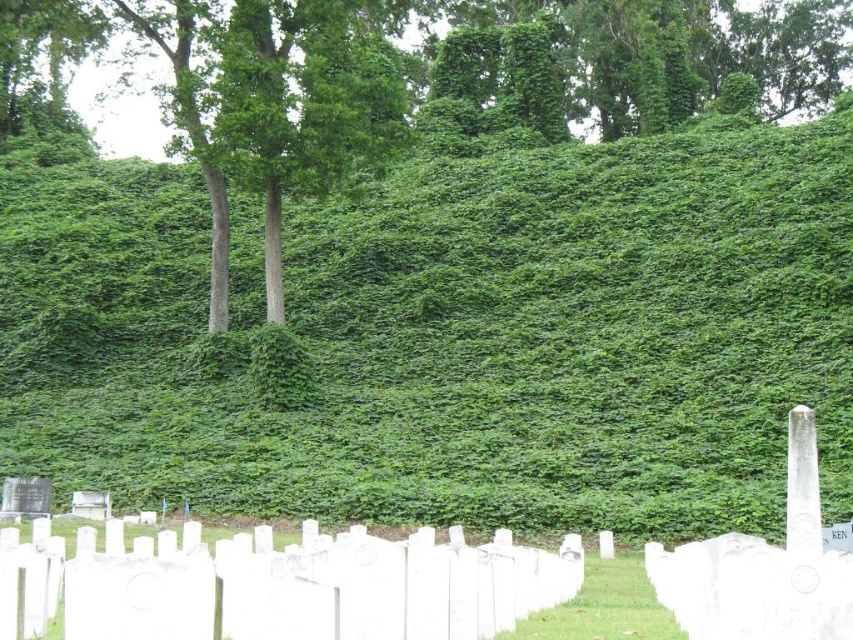
Question: In this image, where is green leafy hillside at center located relative to green leafy tree at upper center?

Choices:
 (A) left
 (B) right

Answer: (B)

Question: Is green leafy hillside at center positioned before green leafy tree at upper center?

Choices:
 (A) yes
 (B) no

Answer: (A)

Question: Does green leafy hillside at center appear over green leafy tree at upper center?

Choices:
 (A) no
 (B) yes

Answer: (A)

Question: Which point is farther to the camera?

Choices:
 (A) green leafy hillside at center
 (B) green leafy tree at upper center

Answer: (B)